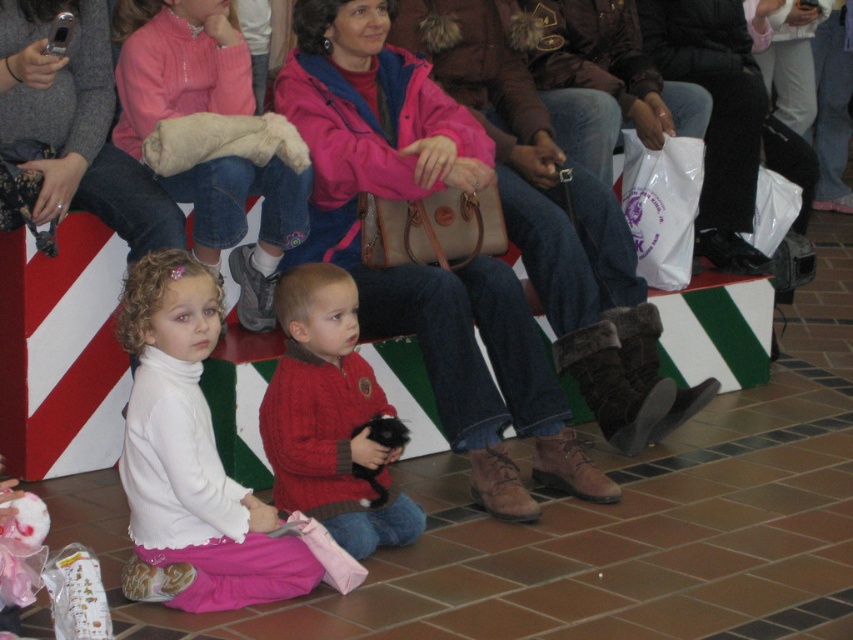
Question: Is cable-knit sweater at center thinner than white plastic bag at center?

Choices:
 (A) yes
 (B) no

Answer: (B)

Question: Which point is closer to the camera?

Choices:
 (A) matte pink jacket at center
 (B) white soft turtleneck at lower left
 (C) white soft sweater at lower left
 (D) white plastic bag at center

Answer: (B)

Question: Estimate the real-world distances between objects in this image. Which object is closer to the white soft turtleneck at lower left?

Choices:
 (A) white plastic bag at center
 (B) cable-knit sweater at center
 (C) matte pink jacket at center
 (D) white soft sweater at lower left

Answer: (B)

Question: Can you confirm if white soft turtleneck at lower left is positioned above white soft sweater at lower left?

Choices:
 (A) no
 (B) yes

Answer: (A)

Question: Is the position of matte pink jacket at center more distant than that of cable-knit sweater at center?

Choices:
 (A) yes
 (B) no

Answer: (A)

Question: Among these points, which one is nearest to the camera?

Choices:
 (A) (202, 227)
 (B) (415, 144)

Answer: (A)